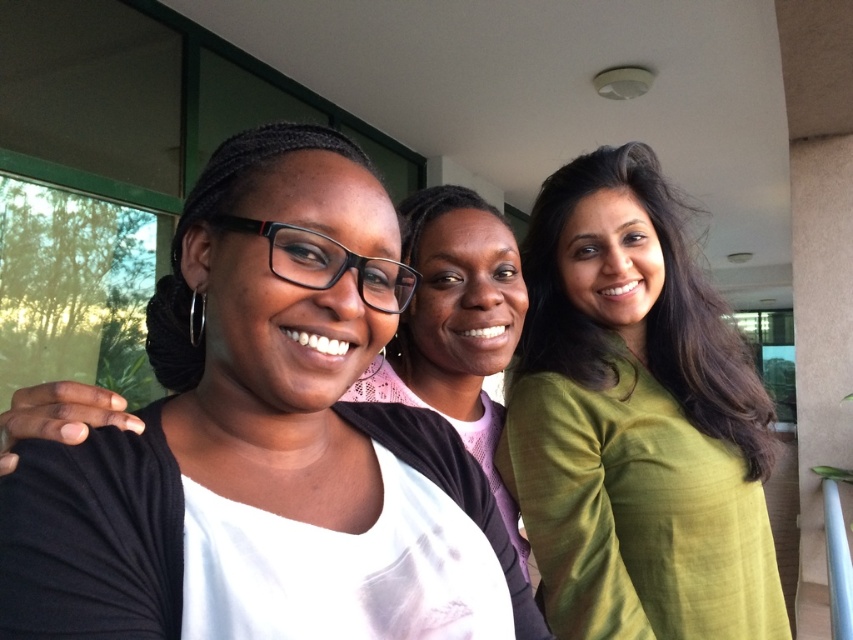
Question: Which of the following is the closest to the observer?

Choices:
 (A) (340, 483)
 (B) (711, 516)

Answer: (A)

Question: Which object appears farthest from the camera in this image?

Choices:
 (A) matte black shirt at center
 (B) green silk shirt at right

Answer: (B)

Question: Is the position of matte black shirt at center less distant than that of green silk shirt at right?

Choices:
 (A) yes
 (B) no

Answer: (A)

Question: Does matte black shirt at center appear under green silk shirt at right?

Choices:
 (A) yes
 (B) no

Answer: (A)

Question: Can you confirm if matte black shirt at center is wider than green silk shirt at right?

Choices:
 (A) no
 (B) yes

Answer: (A)